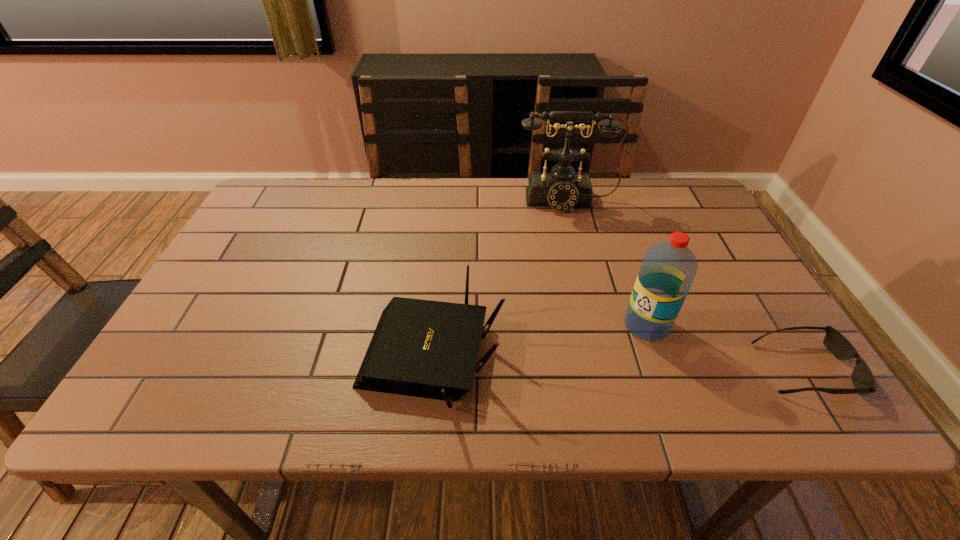
Identify the location of free space located 0.220m on the front label of the water bottle. The height and width of the screenshot is (540, 960). (546, 375).

You are a GUI agent. You are given a task and a screenshot of the screen. Output one action in this format:
    pyautogui.click(x=<x>, y=<y>)
    Task: Click on the free space located on the front label of the water bottle
    
    Given the screenshot: What is the action you would take?
    pyautogui.click(x=558, y=369)

Where is `object that is at the far edge`? object that is at the far edge is located at coordinates (562, 189).

Image resolution: width=960 pixels, height=540 pixels. Identify the location of router present at the near edge. (422, 348).

Identify the location of sunglasses situated at the near edge. This screenshot has height=540, width=960. (862, 377).

Find the location of `water bottle that is at the near edge`. water bottle that is at the near edge is located at coordinates (668, 269).

I want to click on object present at the right edge, so click(x=862, y=377).

Locate an element on the screen. object that is at the near right corner is located at coordinates (862, 377).

The width and height of the screenshot is (960, 540). In order to click on blank space at the far edge of the desktop in this screenshot , I will do `click(554, 224)`.

Locate an element on the screen. This screenshot has height=540, width=960. free space at the left edge of the desktop is located at coordinates (193, 306).